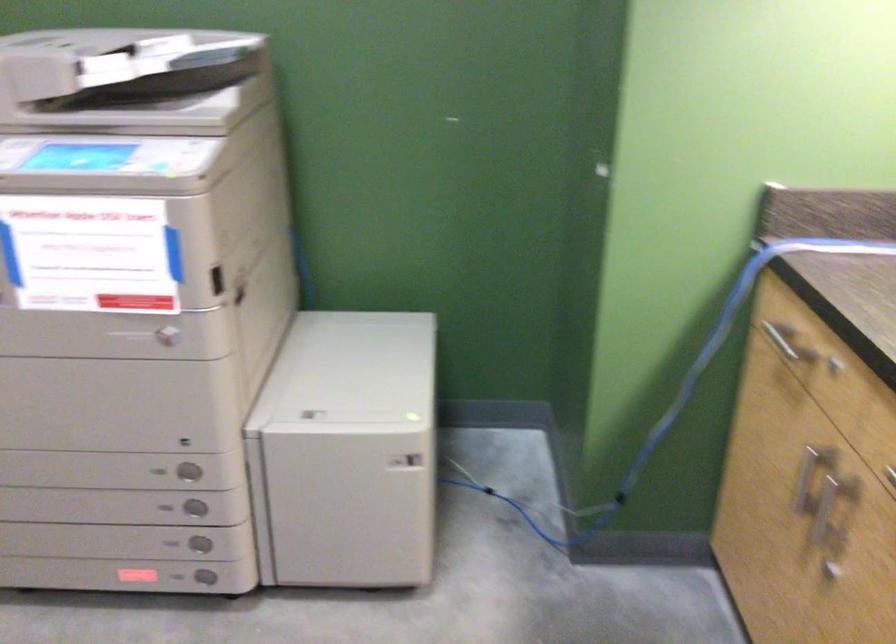
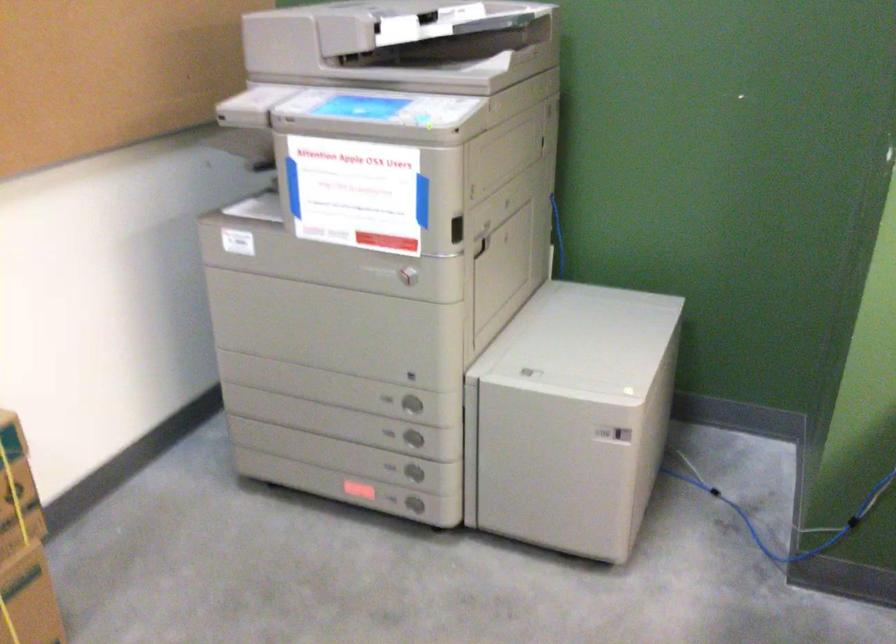
In the second image, find the point that corresponds to point 195,509 in the first image.

(412, 438)